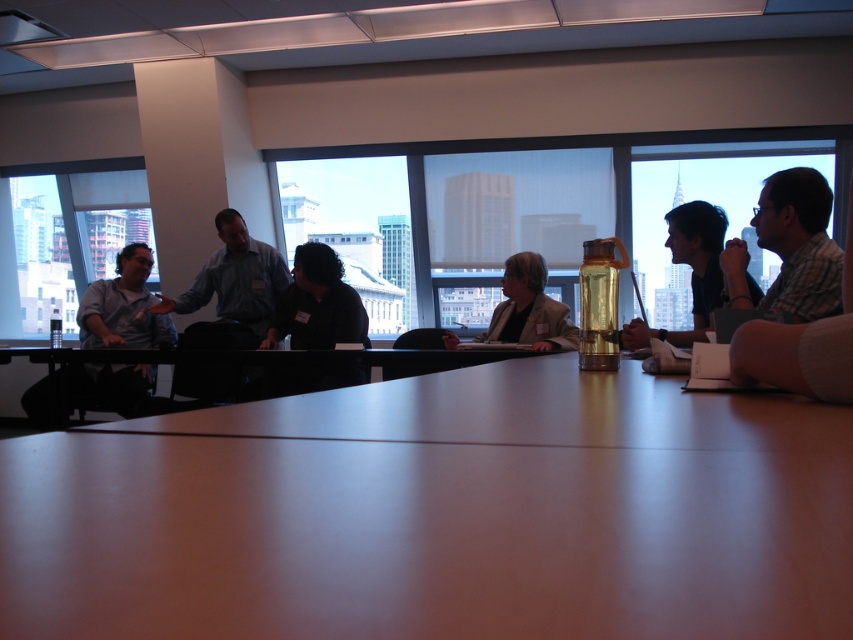
You are a guest at a meeting seated at the conference table. You need to reach for the translucent plastic bottle at center to take a sip. Is the dark gray shirt at center in your way?

The dark gray shirt at center is located above the translucent plastic bottle at center, so it is blocking your access to the bottle. You would need to move the shirt or ask the person wearing it to move it aside to reach the bottle.

You are a photographer who needs to capture a closeup shot of the plaid shirt at right without moving any objects. The camera has a minimum focusing distance of 5 feet. Can you take the photo from the camera position?

The plaid shirt at right and camera are 5.30 feet apart from each other. Since the minimum focusing distance is 5 feet, the photographer can take the photo as the distance is sufficient.

You are a photographer standing behind the conference table. You want to take a photo of the plaid shirt at right and the dark gray shirt at center. Which shirt will appear larger in the photo?

The plaid shirt at right will appear larger in the photo because it is closer to the viewer than the dark gray shirt at center.